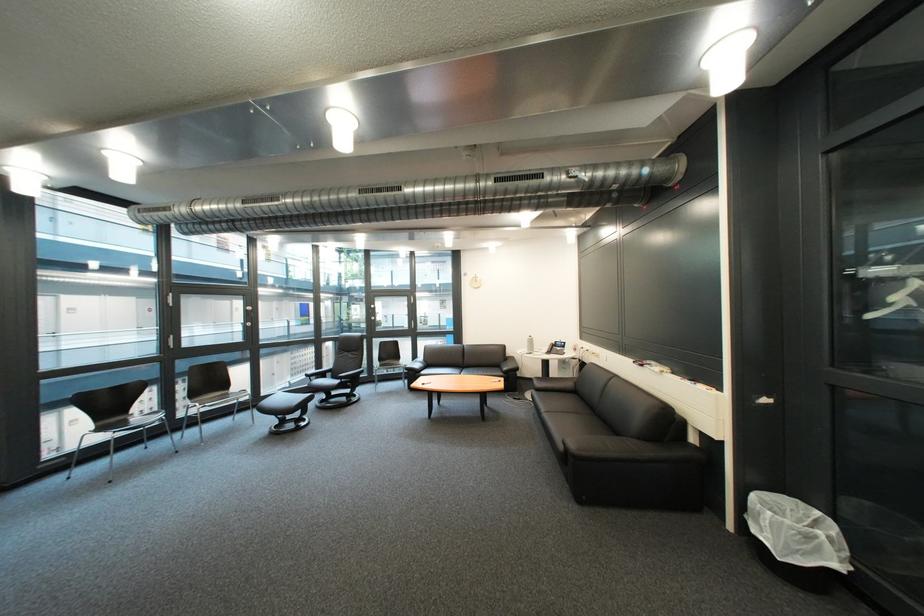
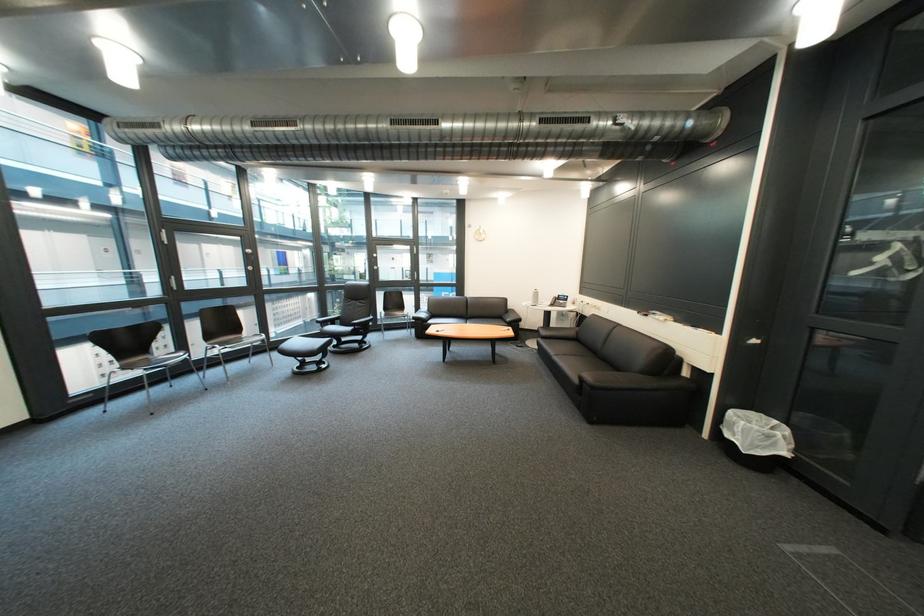
Find the pixel in the second image that matches point 106,430 in the first image.

(131, 368)